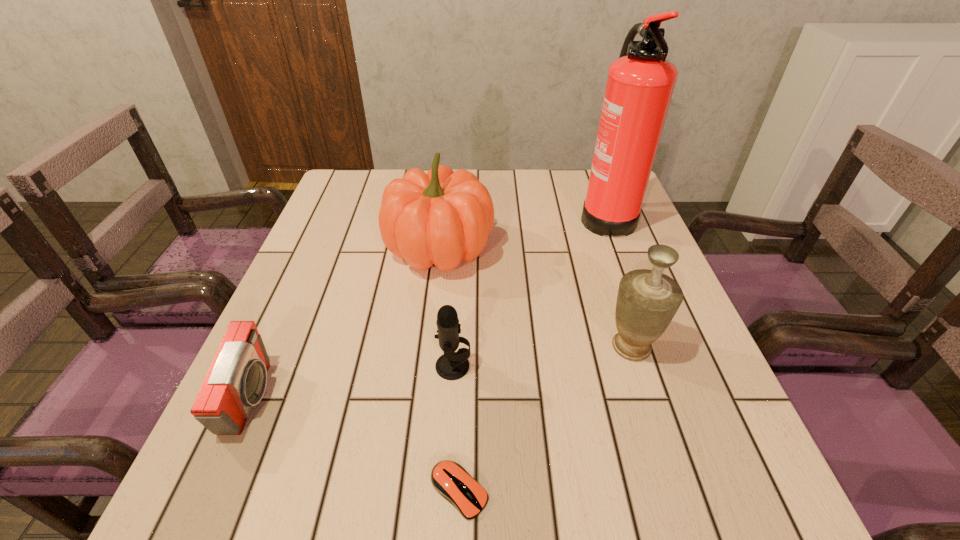
Locate an element on the screen. Image resolution: width=960 pixels, height=540 pixels. free space that is in between the tallest object and the pumpkin is located at coordinates (523, 231).

Find the location of a particular element. This screenshot has height=540, width=960. vacant area that lies between the nearest object and the tallest object is located at coordinates (533, 353).

Find the location of a particular element. The width and height of the screenshot is (960, 540). vacant space in between the fire extinguisher and the pumpkin is located at coordinates (523, 231).

The height and width of the screenshot is (540, 960). What are the coordinates of `free space between the microphone and the computer mouse` in the screenshot? It's located at (456, 429).

This screenshot has width=960, height=540. Identify the location of free space between the microphone and the shortest object. (456, 429).

Select which object appears as the third closest to the computer mouse. Please provide its 2D coordinates. Your answer should be formatted as a tuple, i.e. [(x, y)], where the tuple contains the x and y coordinates of a point satisfying the conditions above.

[(236, 381)]

The width and height of the screenshot is (960, 540). I want to click on object that ranks as the second closest to the microphone, so click(443, 217).

The image size is (960, 540). Identify the location of vacant position in the image that satisfies the following two spatial constraints: 1. on the back side of the nearest object; 2. on the front-facing side of the leftmost object. (463, 398).

Image resolution: width=960 pixels, height=540 pixels. What are the coordinates of `blank space that satisfies the following two spatial constraints: 1. at the nozzle of the fire extinguisher; 2. on the front side of the urn` in the screenshot? It's located at (656, 347).

Locate an element on the screen. The image size is (960, 540). vacant space that satisfies the following two spatial constraints: 1. on the front-facing side of the leftmost object; 2. on the left side of the nearest object is located at coordinates (210, 491).